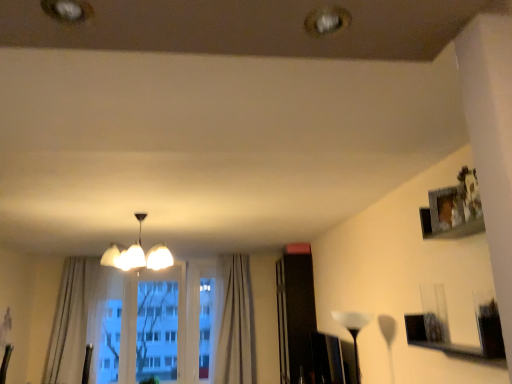
Question: Which direction should I rotate to look at white translucent lampshade at center, positioned as the 2th lamp in left-to-right order, — up or down?

Choices:
 (A) down
 (B) up

Answer: (A)

Question: Does white glossy chandelier at center, the second lamp from the bottom, have a lesser height compared to white translucent lampshade at center, positioned as the 2th lamp in left-to-right order?

Choices:
 (A) no
 (B) yes

Answer: (B)

Question: From the image's perspective, is white glossy chandelier at center, the second lamp from the bottom, below white translucent lampshade at center, positioned as the 2th lamp in left-to-right order?

Choices:
 (A) no
 (B) yes

Answer: (A)

Question: Does white glossy chandelier at center, the first lamp positioned from the top, have a greater height compared to white translucent lampshade at center, which is the 1th lamp from right to left?

Choices:
 (A) yes
 (B) no

Answer: (B)

Question: Is white glossy chandelier at center, the first lamp positioned from the top, oriented towards white translucent lampshade at center, the 2th lamp from the top?

Choices:
 (A) yes
 (B) no

Answer: (B)

Question: Considering the relative sizes of white glossy chandelier at center, placed as the second lamp when sorted from right to left, and white translucent lampshade at center, placed as the 1th lamp when sorted from bottom to top, in the image provided, is white glossy chandelier at center, placed as the second lamp when sorted from right to left, smaller than white translucent lampshade at center, placed as the 1th lamp when sorted from bottom to top,?

Choices:
 (A) no
 (B) yes

Answer: (A)

Question: Is white glossy chandelier at center, the second lamp from the bottom, not within white translucent lampshade at center, the 2th lamp from the top?

Choices:
 (A) yes
 (B) no

Answer: (A)

Question: From a real-world perspective, is light beige fabric curtain at left, acting as the second curtain starting from the right, positioned over light beige textured curtain at center, the 1th curtain viewed from the right, based on gravity?

Choices:
 (A) no
 (B) yes

Answer: (B)

Question: Does light beige fabric curtain at left, the first curtain from the left, have a greater height compared to light beige textured curtain at center, the 1th curtain viewed from the right?

Choices:
 (A) no
 (B) yes

Answer: (A)

Question: Is light beige fabric curtain at left, acting as the second curtain starting from the right, touching light beige textured curtain at center, the 1th curtain viewed from the right?

Choices:
 (A) no
 (B) yes

Answer: (A)

Question: Does light beige fabric curtain at left, the first curtain from the left, have a lesser height compared to light beige textured curtain at center, which appears as the second curtain when viewed from the left?

Choices:
 (A) no
 (B) yes

Answer: (B)

Question: Does light beige fabric curtain at left, acting as the second curtain starting from the right, come behind light beige textured curtain at center, the 1th curtain viewed from the right?

Choices:
 (A) no
 (B) yes

Answer: (A)

Question: Is light beige fabric curtain at left, acting as the second curtain starting from the right, thinner than light beige textured curtain at center, which appears as the second curtain when viewed from the left?

Choices:
 (A) no
 (B) yes

Answer: (A)

Question: Is transparent glass window at center to the left of white translucent lampshade at center, the 2th lamp from the top, from the viewer's perspective?

Choices:
 (A) yes
 (B) no

Answer: (A)